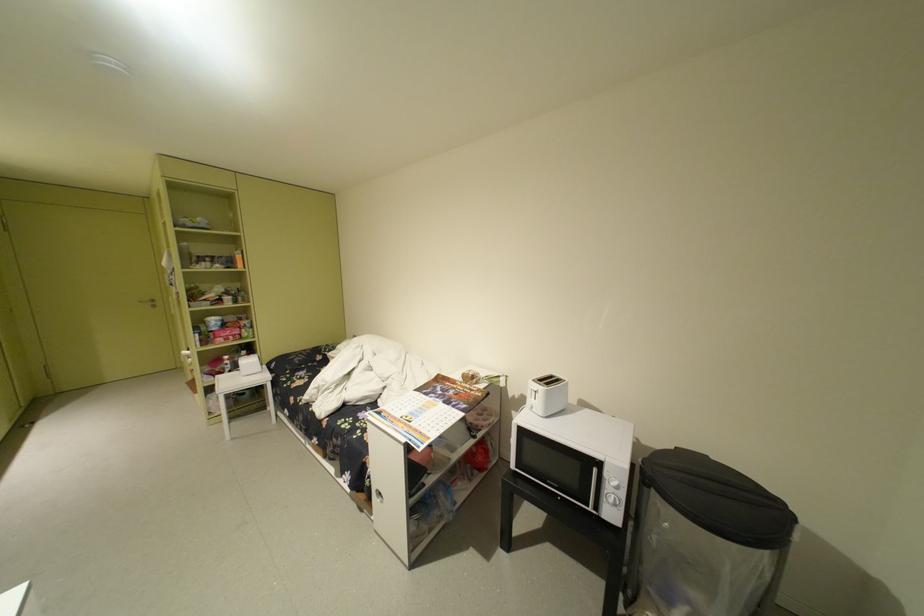
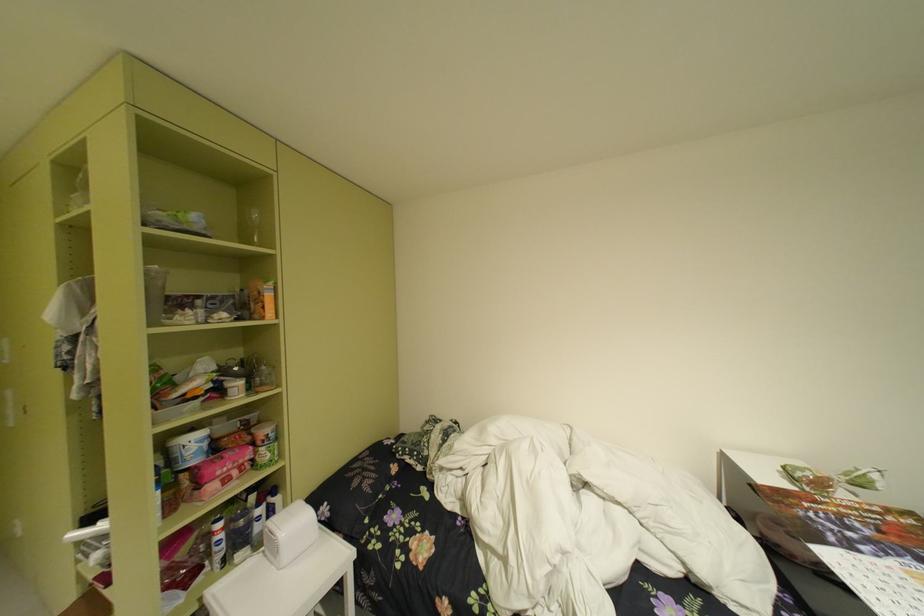
Where in the second image is the point corresponding to point (238, 360) from the first image?

(235, 528)